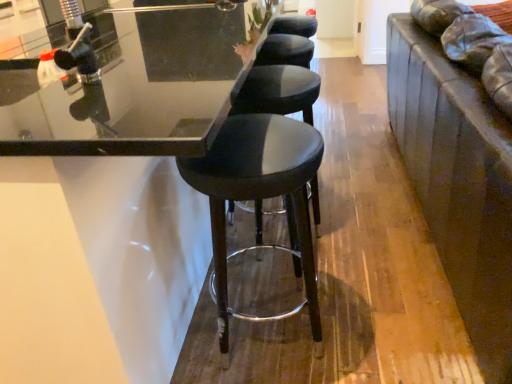
I want to click on free location to the right of black leather stool at center, which is the first stool from back to front, so click(357, 230).